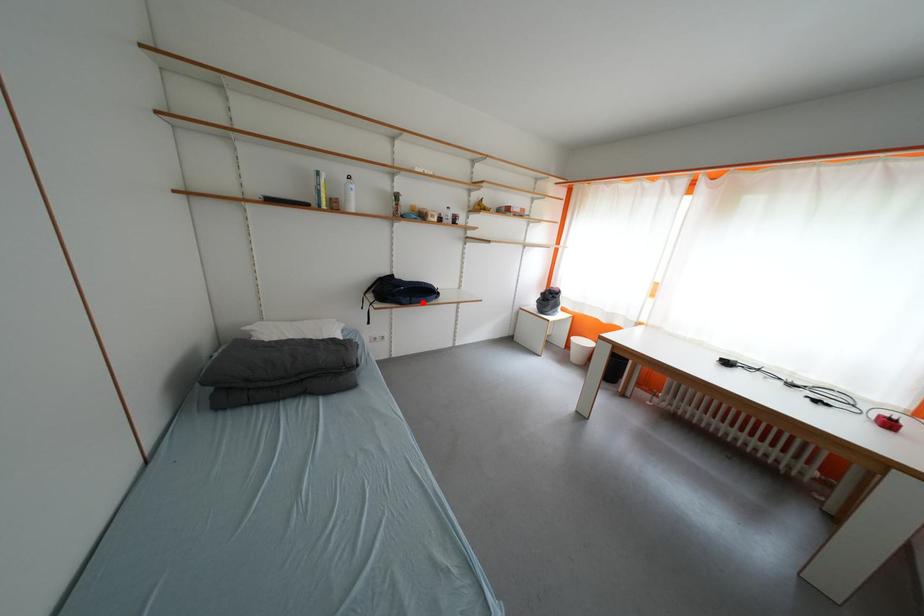
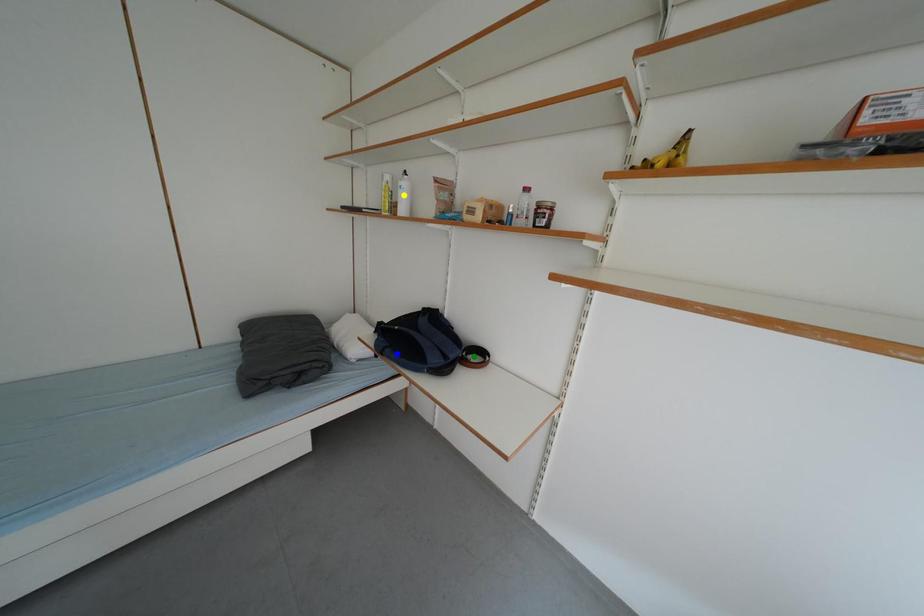
Question: I am providing you with two images of the same scene from different viewpoints. A red point is marked on the first image. You are given multiple points on the second image. Which spot in image 2 lines up with the point in image 1?

Choices:
 (A) blue point
 (B) yellow point
 (C) green point

Answer: (A)